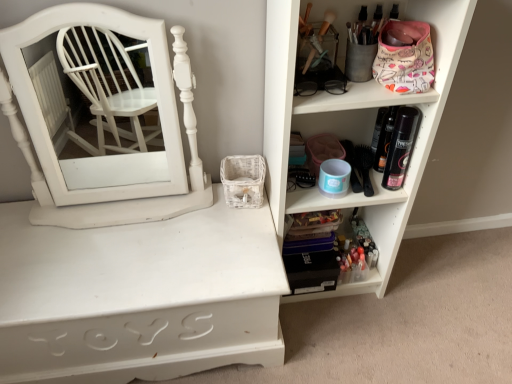
Question: Should I look upward or downward to see translucent plastic makeup at lower right, which appears as the second shelf when viewed from the left?

Choices:
 (A) up
 (B) down

Answer: (B)

Question: Is the depth of white plastic shelf at upper right, placed as the third shelf when sorted from left to right, greater than that of white wood medicine cabinet at left?

Choices:
 (A) no
 (B) yes

Answer: (A)

Question: Is white plastic shelf at upper right, placed as the third shelf when sorted from left to right, bigger than white wood medicine cabinet at left?

Choices:
 (A) no
 (B) yes

Answer: (B)

Question: Is white plastic shelf at upper right, placed as the third shelf when sorted from left to right, at the left side of white wood medicine cabinet at left?

Choices:
 (A) yes
 (B) no

Answer: (B)

Question: Does white plastic shelf at upper right, the first shelf positioned from the right, have a smaller size compared to white wood medicine cabinet at left?

Choices:
 (A) yes
 (B) no

Answer: (B)

Question: Is white plastic shelf at upper right, placed as the third shelf when sorted from left to right, beside white wood medicine cabinet at left?

Choices:
 (A) yes
 (B) no

Answer: (B)

Question: Is white plastic shelf at upper right, the first shelf positioned from the right, oriented towards white wood medicine cabinet at left?

Choices:
 (A) no
 (B) yes

Answer: (A)

Question: Does translucent plastic makeup at lower right, which appears as the second shelf when viewed from the left, come behind white wood medicine cabinet at left?

Choices:
 (A) no
 (B) yes

Answer: (B)

Question: Is translucent plastic makeup at lower right, which appears as the second shelf when viewed from the left, oriented away from white wood medicine cabinet at left?

Choices:
 (A) yes
 (B) no

Answer: (B)

Question: Is translucent plastic makeup at lower right, which appears as the second shelf when viewed from the left, oriented towards white wood medicine cabinet at left?

Choices:
 (A) no
 (B) yes

Answer: (A)

Question: Can you confirm if translucent plastic makeup at lower right, marked as the second shelf in a right-to-left arrangement, is shorter than white wood medicine cabinet at left?

Choices:
 (A) no
 (B) yes

Answer: (B)

Question: Is white wood medicine cabinet at left inside translucent plastic makeup at lower right, marked as the second shelf in a right-to-left arrangement?

Choices:
 (A) yes
 (B) no

Answer: (B)

Question: Considering the relative sizes of translucent plastic makeup at lower right, which appears as the second shelf when viewed from the left, and white wood medicine cabinet at left in the image provided, is translucent plastic makeup at lower right, which appears as the second shelf when viewed from the left, thinner than white wood medicine cabinet at left?

Choices:
 (A) yes
 (B) no

Answer: (A)

Question: Is white wood medicine cabinet at left thinner than white painted wood shelf at center, marked as the 1th shelf in a left-to-right arrangement?

Choices:
 (A) yes
 (B) no

Answer: (A)